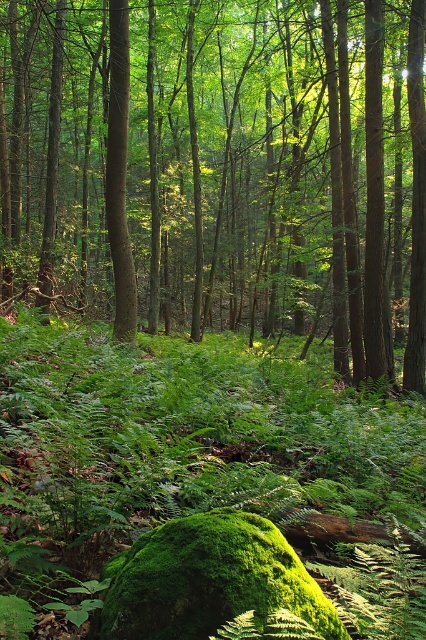
Question: Observing the image, what is the correct spatial positioning of green leafy tree at center in reference to green matte tree trunk at center?

Choices:
 (A) right
 (B) left

Answer: (A)

Question: Which object appears farthest from the camera in this image?

Choices:
 (A) green leafy tree at center
 (B) green matte tree trunk at center

Answer: (B)

Question: Does green leafy tree at center lie in front of green matte tree trunk at center?

Choices:
 (A) yes
 (B) no

Answer: (A)

Question: Is the position of green leafy tree at center more distant than that of green matte tree trunk at center?

Choices:
 (A) no
 (B) yes

Answer: (A)

Question: Which of the following is the farthest from the observer?

Choices:
 (A) tap(78, 61)
 (B) tap(117, 280)

Answer: (A)